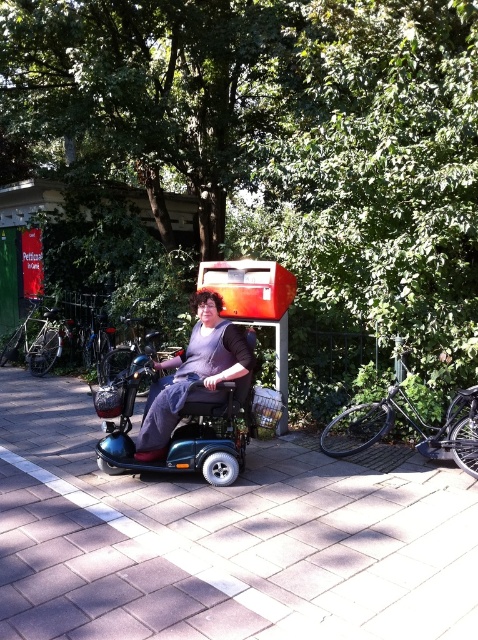
Can you confirm if brick pavement at center is smaller than black matte bicycle at right?

No, brick pavement at center is not smaller than black matte bicycle at right.

Which is more to the left, brick pavement at center or black matte bicycle at right?

From the viewer's perspective, brick pavement at center appears more on the left side.

Image resolution: width=478 pixels, height=640 pixels. Identify the location of brick pavement at center. (221, 540).

The image size is (478, 640). Describe the element at coordinates (195, 374) in the screenshot. I see `teal plastic wheelchair at center` at that location.

How distant is teal plastic wheelchair at center from black matte bicycle at right?

The distance of teal plastic wheelchair at center from black matte bicycle at right is 4.44 feet.

The width and height of the screenshot is (478, 640). Describe the element at coordinates (195, 374) in the screenshot. I see `teal plastic wheelchair at center` at that location.

Where is `teal plastic wheelchair at center`? teal plastic wheelchair at center is located at coordinates (195, 374).

Between point (89, 563) and point (182, 372), which one is positioned behind?

Point (182, 372)

Between brick pavement at center and teal plastic wheelchair at center, which one appears on the right side from the viewer's perspective?

teal plastic wheelchair at center

You are a GUI agent. You are given a task and a screenshot of the screen. Output one action in this format:
    pyautogui.click(x=<x>, y=<y>)
    Task: Click on the brick pavement at center
    This screenshot has width=478, height=640.
    Given the screenshot: What is the action you would take?
    pyautogui.click(x=221, y=540)